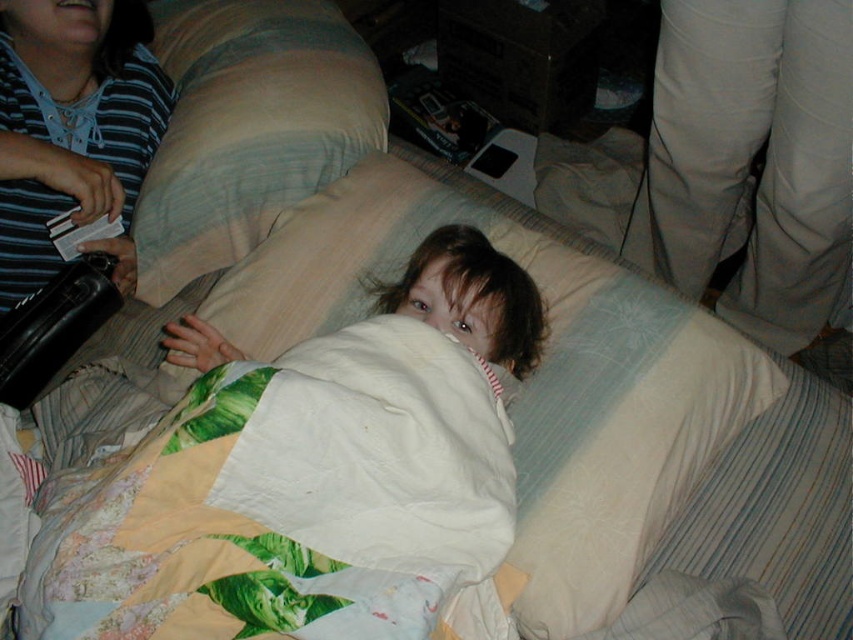
Question: Does white quilted blanket at center have a greater width compared to white textured pillow at upper center?

Choices:
 (A) yes
 (B) no

Answer: (A)

Question: Is white quilted blanket at center thinner than white textured pillow at upper center?

Choices:
 (A) no
 (B) yes

Answer: (A)

Question: Does white quilted blanket at center have a lesser width compared to white textured pillow at upper center?

Choices:
 (A) yes
 (B) no

Answer: (B)